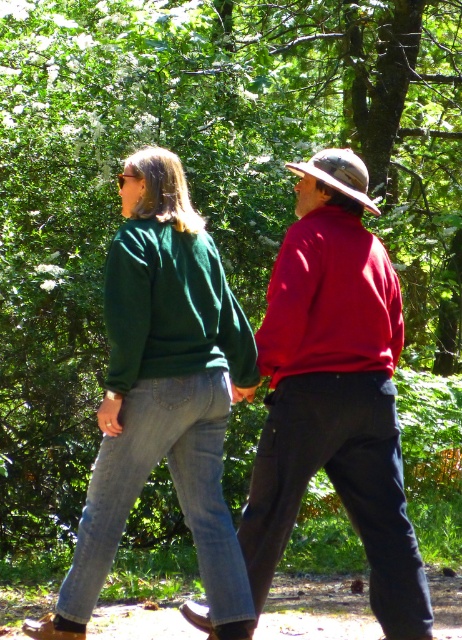
You are a hiker planning to wear a sweater for a hike. You see two sweaters in the image, the matte red sweater at center and the green fleece sweater at center. Which sweater is taller?

The matte red sweater at center is taller than the green fleece sweater at center according to the description.

You are a hiker planning to wear a sweater for a day hike in the forest. You have both the matte red sweater at center and the green fleece sweater at center. Which sweater would you choose if you want one that is wider to allow for better arm movement?

The matte red sweater at center has a larger width than the green fleece sweater at center, so it would be better for allowing better arm movement during the hike.